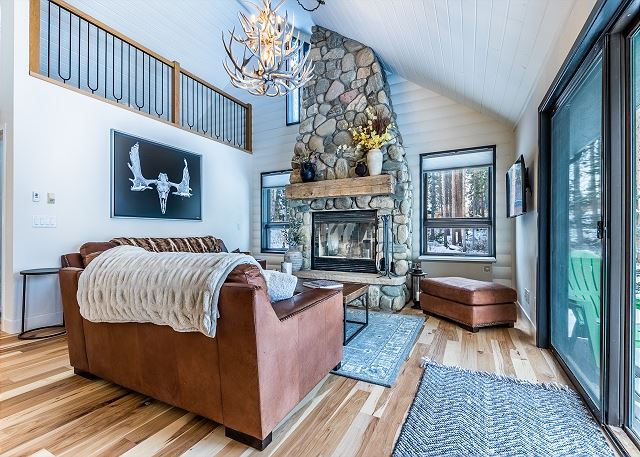
This screenshot has width=640, height=457. Find the location of `the back tan wall`. the back tan wall is located at coordinates (258, 102), (269, 148), (412, 99), (460, 121), (420, 128).